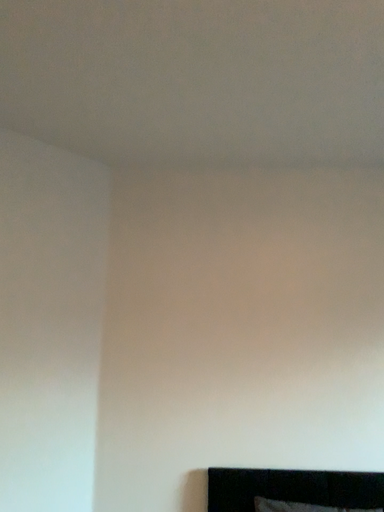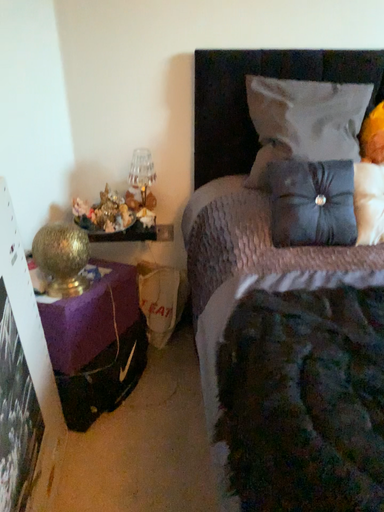
Question: Which way did the camera rotate in the video?

Choices:
 (A) rotated left
 (B) rotated right

Answer: (B)